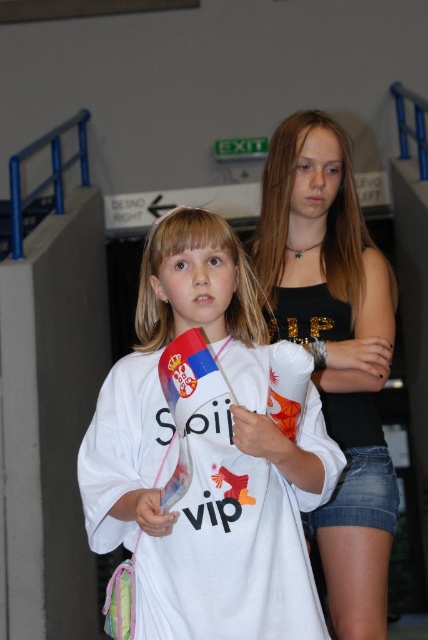
Question: Can you confirm if white cotton shirt at center is positioned below black matte tank top at center?

Choices:
 (A) yes
 (B) no

Answer: (A)

Question: Which object is farther from the camera taking this photo?

Choices:
 (A) black matte tank top at center
 (B) white cotton shirt at center

Answer: (A)

Question: Does white cotton shirt at center appear on the right side of black matte tank top at center?

Choices:
 (A) yes
 (B) no

Answer: (B)

Question: Does white cotton shirt at center come in front of black matte tank top at center?

Choices:
 (A) no
 (B) yes

Answer: (B)